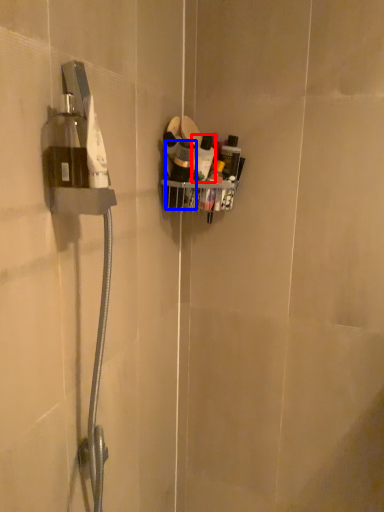
Question: Which object is closer to the camera taking this photo, toiletry (highlighted by a red box) or toiletry (highlighted by a blue box)?

Choices:
 (A) toiletry
 (B) toiletry

Answer: (B)